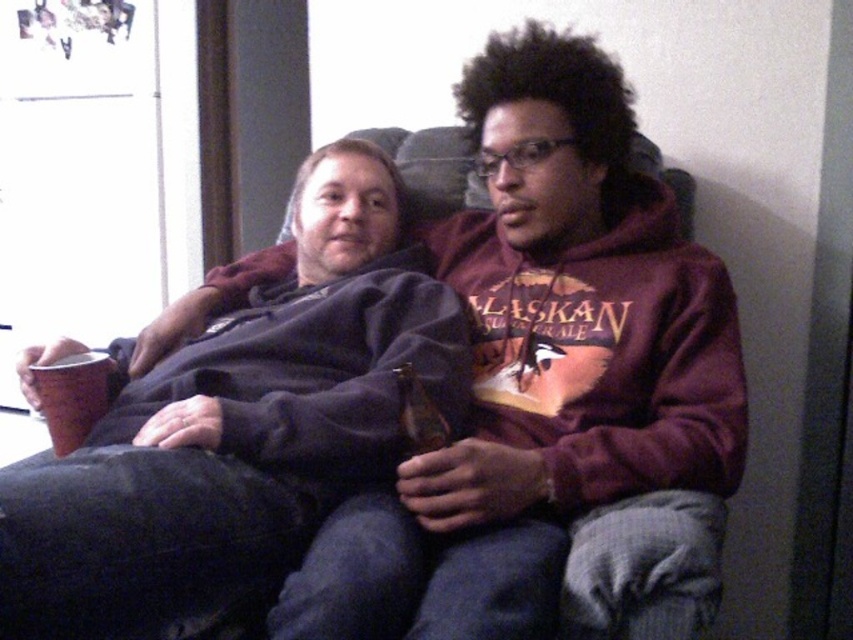
Question: Can you confirm if matte black mug at left is positioned above translucent glass beer bottle at center?

Choices:
 (A) yes
 (B) no

Answer: (A)

Question: Which object appears closest to the camera in this image?

Choices:
 (A) matte black mug at left
 (B) translucent glass beer bottle at center
 (C) matte black hoodie at center

Answer: (A)

Question: Is matte black mug at left wider than translucent glass beer bottle at center?

Choices:
 (A) yes
 (B) no

Answer: (A)

Question: Which point is farther to the camera?

Choices:
 (A) (418, 420)
 (B) (518, 172)
 (C) (107, 346)

Answer: (C)

Question: Among these points, which one is nearest to the camera?

Choices:
 (A) (409, 433)
 (B) (119, 444)

Answer: (A)

Question: Is matte black hoodie at center positioned at the back of translucent glass beer bottle at center?

Choices:
 (A) no
 (B) yes

Answer: (A)